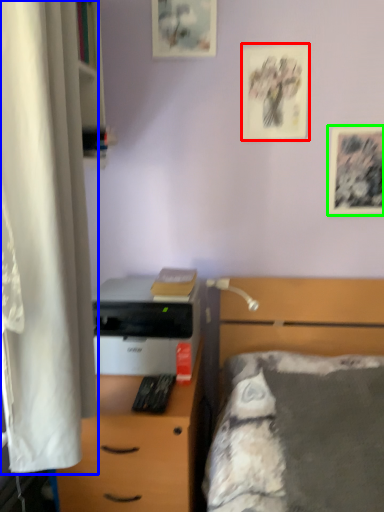
Question: Which object is the farthest from picture frame (highlighted by a red box)? Choose among these: curtain (highlighted by a blue box) or picture frame (highlighted by a green box).

Choices:
 (A) curtain
 (B) picture frame

Answer: (A)